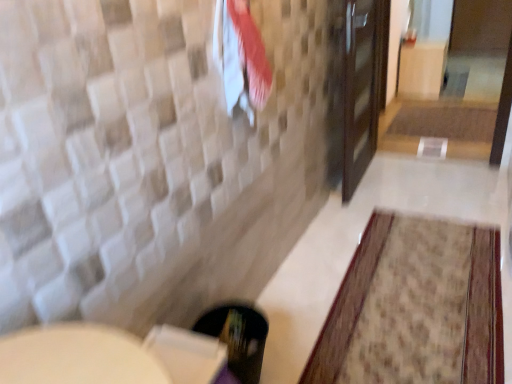
Describe the element at coordinates (484, 312) in the screenshot. Image resolution: width=512 pixels, height=384 pixels. I see `beige textured rug at lower right, the first bath mat viewed from the front` at that location.

Locate an element on the screen. brown textured bath mat at center, placed as the first bath mat when sorted from right to left is located at coordinates (445, 120).

Where is `bath mat above the white cotton beach towel at upper center (from the image's perspective)`? bath mat above the white cotton beach towel at upper center (from the image's perspective) is located at coordinates (445, 120).

Which is closer, (259, 107) or (411, 134)?

Point (259, 107) is positioned closer to the camera compared to point (411, 134).

Considering the relative sizes of white cotton beach towel at upper center and brown textured bath mat at center, the second bath mat when ordered from left to right, in the image provided, is white cotton beach towel at upper center smaller than brown textured bath mat at center, the second bath mat when ordered from left to right,?

Correct, white cotton beach towel at upper center occupies less space than brown textured bath mat at center, the second bath mat when ordered from left to right.

Can you confirm if white cotton beach towel at upper center is shorter than brown textured bath mat at center, the 1th bath mat from the back?

Incorrect, the height of white cotton beach towel at upper center does not fall short of that of brown textured bath mat at center, the 1th bath mat from the back.

From a real-world perspective, who is located higher, brown textured bath mat at center, the 2th bath mat viewed from the front, or white cotton beach towel at upper center?

white cotton beach towel at upper center.

Does brown textured bath mat at center, the 1th bath mat from the back, have a greater width compared to white cotton beach towel at upper center?

Yes, brown textured bath mat at center, the 1th bath mat from the back, is wider than white cotton beach towel at upper center.

From the image's perspective, between brown textured bath mat at center, the 2th bath mat viewed from the front, and white cotton beach towel at upper center, which one is located above?

brown textured bath mat at center, the 2th bath mat viewed from the front, is shown above in the image.

Based on their sizes in the image, would you say brown textured bath mat at center, the 2th bath mat viewed from the front, is bigger or smaller than beige textured rug at lower right, the 1th bath mat ordered from the bottom?

Clearly, brown textured bath mat at center, the 2th bath mat viewed from the front, is larger in size than beige textured rug at lower right, the 1th bath mat ordered from the bottom.

At what (x,y) coordinates should I click in order to perform the action: click on bath mat that appears on the right of beige textured rug at lower right, the second bath mat positioned from the back. Please return your answer as a coordinate pair (x, y). The height and width of the screenshot is (384, 512). Looking at the image, I should click on (445, 120).

From a real-world perspective, who is located higher, brown textured bath mat at center, the 2th bath mat viewed from the front, or beige textured rug at lower right, placed as the first bath mat when sorted from left to right?

brown textured bath mat at center, the 2th bath mat viewed from the front, from a real-world perspective.

Is brown textured bath mat at center, the second bath mat when ordered from left to right, positioned far away from beige textured rug at lower right, the 1th bath mat ordered from the bottom?

brown textured bath mat at center, the second bath mat when ordered from left to right, is far away from beige textured rug at lower right, the 1th bath mat ordered from the bottom.

From a real-world perspective, is white cotton beach towel at upper center located higher than beige textured rug at lower right, the 1th bath mat ordered from the bottom?

Yes.

Is white cotton beach towel at upper center with beige textured rug at lower right, positioned as the 2th bath mat in top-to-bottom order?

No, white cotton beach towel at upper center is not next to beige textured rug at lower right, positioned as the 2th bath mat in top-to-bottom order.

Which point is more forward, (268, 74) or (340, 308)?

The point (268, 74) is in front.

Based on the photo, from a real-world perspective, is beige textured rug at lower right, placed as the first bath mat when sorted from left to right, physically below white cotton beach towel at upper center?

Correct, in the physical world, beige textured rug at lower right, placed as the first bath mat when sorted from left to right, is lower than white cotton beach towel at upper center.

Can you confirm if beige textured rug at lower right, the first bath mat viewed from the front, is taller than white cotton beach towel at upper center?

In fact, beige textured rug at lower right, the first bath mat viewed from the front, may be shorter than white cotton beach towel at upper center.

Where is `the 1st bath mat behind the white cotton beach towel at upper center, starting your count from the anchor`? The image size is (512, 384). the 1st bath mat behind the white cotton beach towel at upper center, starting your count from the anchor is located at coordinates (484, 312).

Looking at this image, from the image's perspective, does beige textured rug at lower right, the second bath mat positioned from the back, appear lower than brown textured bath mat at center, the second bath mat in the bottom-to-top sequence?

Indeed, from the image's perspective, beige textured rug at lower right, the second bath mat positioned from the back, is shown beneath brown textured bath mat at center, the second bath mat in the bottom-to-top sequence.

How different are the orientations of beige textured rug at lower right, positioned as the 2th bath mat in top-to-bottom order, and brown textured bath mat at center, placed as the first bath mat when sorted from right to left, in degrees?

The facing directions of beige textured rug at lower right, positioned as the 2th bath mat in top-to-bottom order, and brown textured bath mat at center, placed as the first bath mat when sorted from right to left, are 179 degrees apart.

This screenshot has height=384, width=512. Find the location of `bath mat on the left of brown textured bath mat at center, positioned as the 1th bath mat in top-to-bottom order`. bath mat on the left of brown textured bath mat at center, positioned as the 1th bath mat in top-to-bottom order is located at coordinates (484, 312).

Is beige textured rug at lower right, the first bath mat viewed from the front, wider than brown textured bath mat at center, the second bath mat in the bottom-to-top sequence?

Indeed, beige textured rug at lower right, the first bath mat viewed from the front, has a greater width compared to brown textured bath mat at center, the second bath mat in the bottom-to-top sequence.

Locate an element on the screen. The height and width of the screenshot is (384, 512). beach towel located below the brown textured bath mat at center, the second bath mat in the bottom-to-top sequence (from the image's perspective) is located at coordinates (241, 57).

The image size is (512, 384). I want to click on bath mat that appears above the white cotton beach towel at upper center (from the image's perspective), so tap(445, 120).

Which object lies further to the anchor point white cotton beach towel at upper center, beige textured rug at lower right, the first bath mat viewed from the front, or brown textured bath mat at center, the 2th bath mat viewed from the front?

The object further to white cotton beach towel at upper center is brown textured bath mat at center, the 2th bath mat viewed from the front.

From the image, which object appears to be nearer to beige textured rug at lower right, the second bath mat positioned from the back, brown textured bath mat at center, the second bath mat in the bottom-to-top sequence, or white cotton beach towel at upper center?

The object closer to beige textured rug at lower right, the second bath mat positioned from the back, is white cotton beach towel at upper center.

From the image, which object appears to be nearer to brown textured bath mat at center, placed as the first bath mat when sorted from right to left, beige textured rug at lower right, the second bath mat positioned from the back, or white cotton beach towel at upper center?

beige textured rug at lower right, the second bath mat positioned from the back, is closer to brown textured bath mat at center, placed as the first bath mat when sorted from right to left.

Based on their spatial positions, is white cotton beach towel at upper center or beige textured rug at lower right, the second bath mat viewed from the right, further from brown textured bath mat at center, positioned as the 1th bath mat in top-to-bottom order?

The object further to brown textured bath mat at center, positioned as the 1th bath mat in top-to-bottom order, is white cotton beach towel at upper center.

From the image, which object appears to be farther from white cotton beach towel at upper center, brown textured bath mat at center, positioned as the 1th bath mat in top-to-bottom order, or beige textured rug at lower right, the second bath mat positioned from the back?

brown textured bath mat at center, positioned as the 1th bath mat in top-to-bottom order.

Which object lies further to the anchor point beige textured rug at lower right, placed as the first bath mat when sorted from left to right, white cotton beach towel at upper center or brown textured bath mat at center, the 1th bath mat from the back?

brown textured bath mat at center, the 1th bath mat from the back, is further to beige textured rug at lower right, placed as the first bath mat when sorted from left to right.

Image resolution: width=512 pixels, height=384 pixels. In order to click on bath mat between white cotton beach towel at upper center and brown textured bath mat at center, the 1th bath mat from the back, in the front-back direction in this screenshot , I will do `click(484, 312)`.